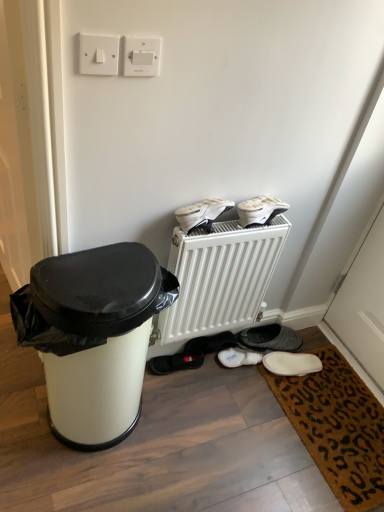
At what (x,y) coordinates should I click in order to perform the action: click on vacant space underneath white plastic radiator at center (from a real-world perspective). Please return your answer as a coordinate pair (x, y). Looking at the image, I should click on (190, 362).